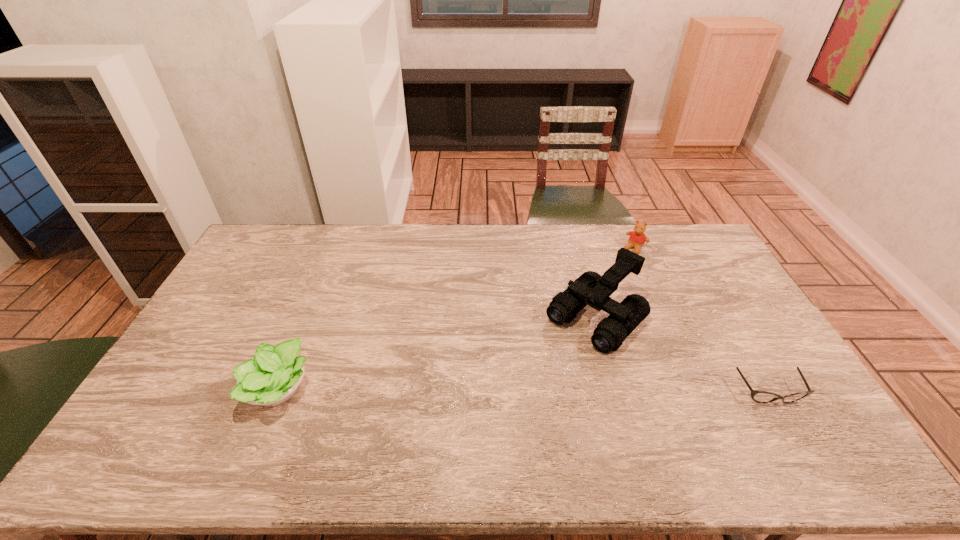
Identify the location of free spot on the desktop that is between the leftmost object and the rightmost object and is positioned on the front-facing side of the teddy bear. The height and width of the screenshot is (540, 960). (530, 390).

Locate an element on the screen. The width and height of the screenshot is (960, 540). free space on the desktop that is between the leftmost object and the spectacles and is positioned on the front lenses of the third object from right to left is located at coordinates (521, 390).